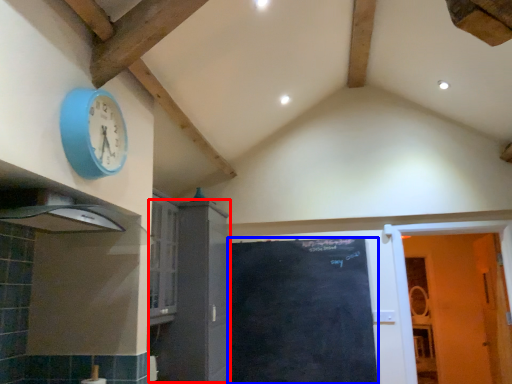
Question: Which of the following is the closest to the observer, cabinetry (highlighted by a red box) or door (highlighted by a blue box)?

Choices:
 (A) cabinetry
 (B) door

Answer: (A)